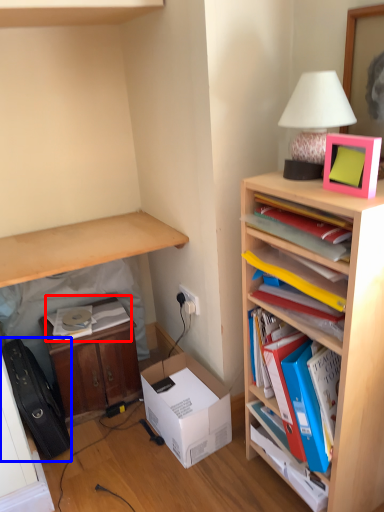
Question: Which of the following is the closest to the observer, book (highlighted by a red box) or luggage (highlighted by a blue box)?

Choices:
 (A) book
 (B) luggage

Answer: (B)